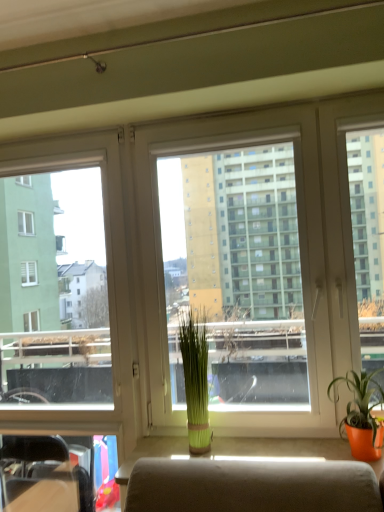
Question: Is matte orange pot at right, which appears as the second houseplant when viewed from the left, situated inside transparent glass window at left or outside?

Choices:
 (A) inside
 (B) outside

Answer: (B)

Question: From the image's perspective, relative to transparent glass window at left, is matte orange pot at right, the 2th houseplant viewed from the back, above or below?

Choices:
 (A) below
 (B) above

Answer: (A)

Question: Estimate the real-world distances between objects in this image. Which object is farther from the transparent glass window at left?

Choices:
 (A) matte orange pot at right, the 1th houseplant positioned from the front
 (B) transparent plastic window screen at center
 (C) green matte plant at center, which is the 1th houseplant in left-to-right order

Answer: (A)

Question: Which of these objects is positioned closest to the transparent plastic window screen at center?

Choices:
 (A) green matte plant at center, the first houseplant viewed from the back
 (B) matte orange pot at right, which appears as the second houseplant when viewed from the left
 (C) transparent glass window at left

Answer: (A)